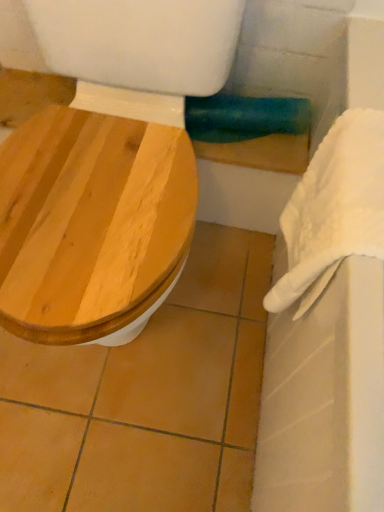
The height and width of the screenshot is (512, 384). In order to click on vacant area that is in front of white fabric towel bar at upper right in this screenshot , I will do `click(270, 147)`.